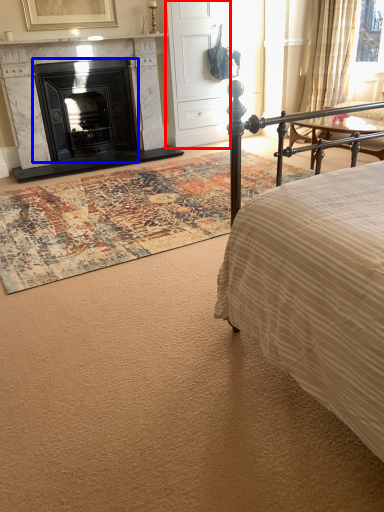
Question: Which object appears closest to the camera in this image, armoire (highlighted by a red box) or fireplace (highlighted by a blue box)?

Choices:
 (A) armoire
 (B) fireplace

Answer: (B)